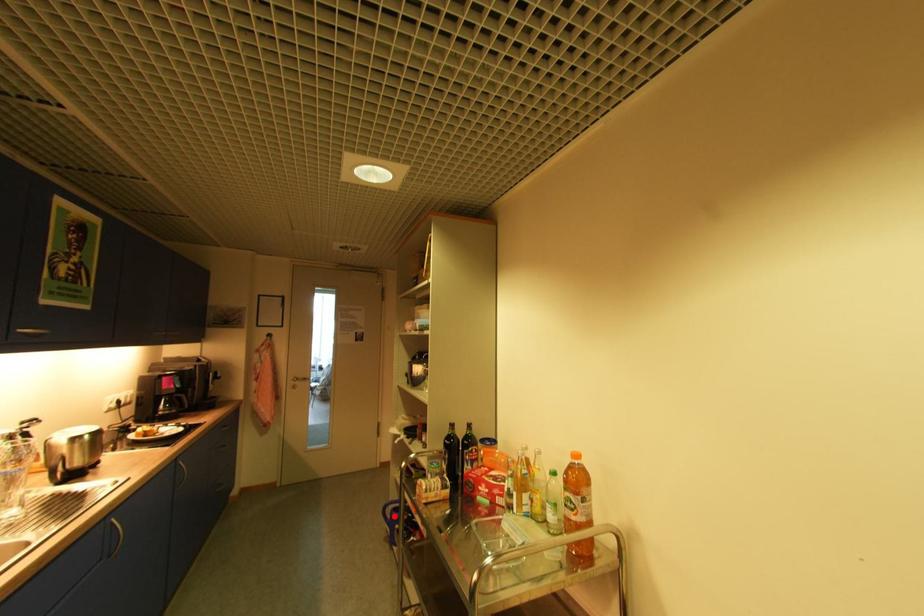
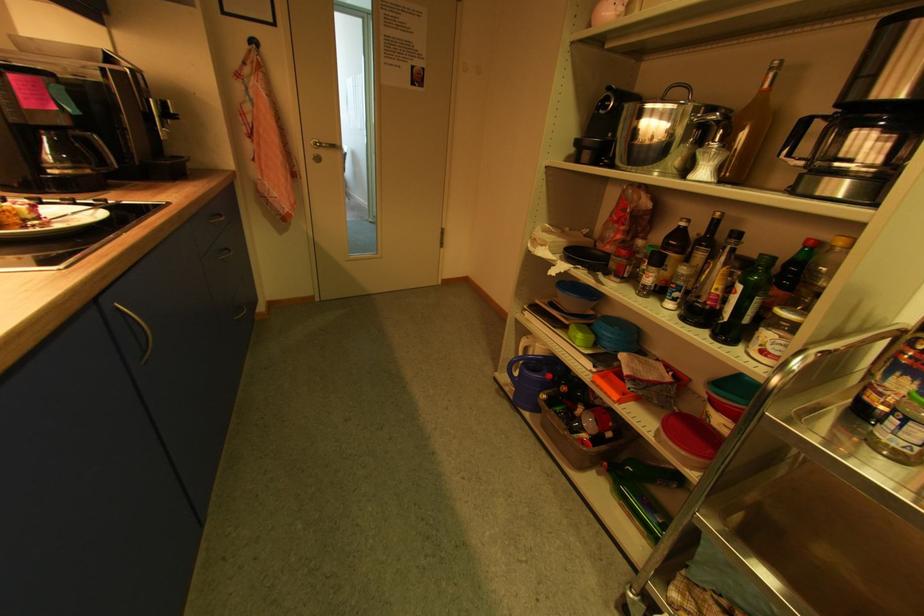
Question: I am providing you with two images of the same scene from different viewpoints. Image1 has a red point marked. In image2, the corresponding 3D location appears at what relative position? Reply with the corresponding letter.

Choices:
 (A) Closer
 (B) Farther

Answer: (A)